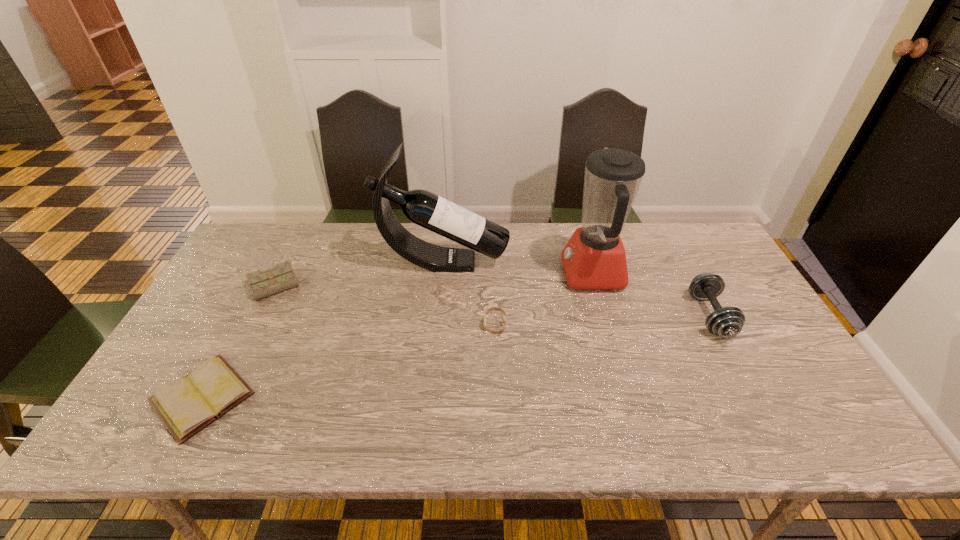
Locate which object ranks third in proximity to the rightmost object. Please provide its 2D coordinates. Your answer should be formatted as a tuple, i.e. [(x, y)], where the tuple contains the x and y coordinates of a point satisfying the conditions above.

[(493, 308)]

This screenshot has width=960, height=540. Identify the location of vacant space that satisfies the following two spatial constraints: 1. on the back side of the shorter diary; 2. on the right side of the fourth shortest object. (246, 316).